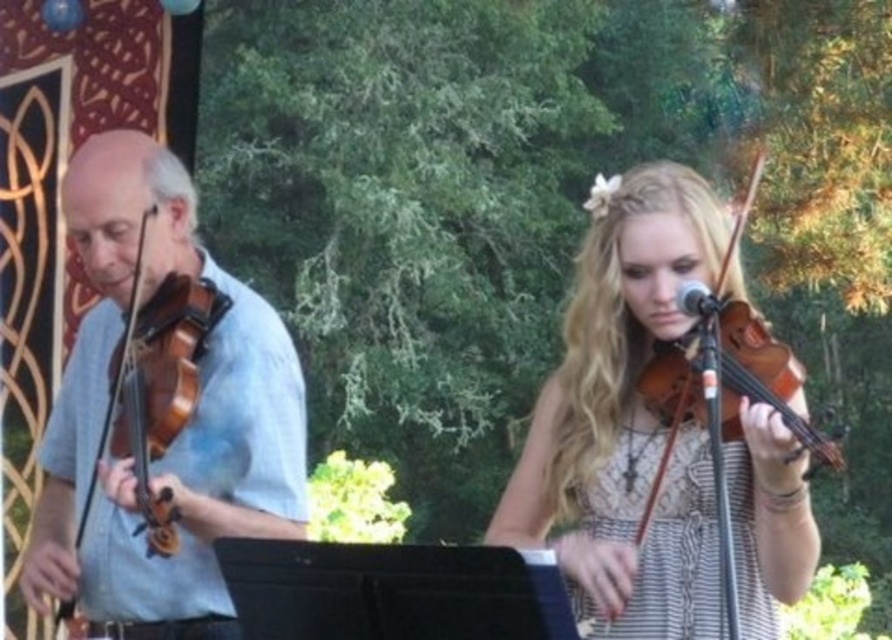
Question: Where is matte brown violin at center located in relation to matte brown violin at left in the image?

Choices:
 (A) above
 (B) below

Answer: (B)

Question: Which point appears farthest from the camera in this image?

Choices:
 (A) (591, 560)
 (B) (89, 376)

Answer: (B)

Question: Does matte brown violin at center appear over matte brown violin at left?

Choices:
 (A) yes
 (B) no

Answer: (B)

Question: Does matte brown violin at center appear on the left side of matte brown violin at left?

Choices:
 (A) yes
 (B) no

Answer: (B)

Question: Which point appears closest to the camera in this image?

Choices:
 (A) (581, 333)
 (B) (122, 493)

Answer: (B)